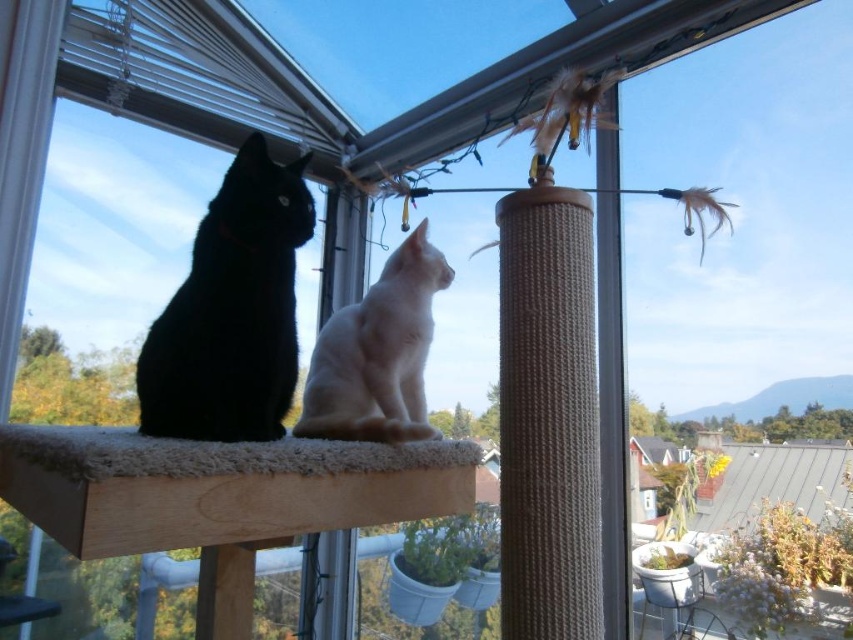
Which is more to the right, braided rope scratching post at center or black matte cat at left?

Positioned to the right is braided rope scratching post at center.

Does point (572, 486) come farther from viewer compared to point (283, 362)?

No.

Describe the element at coordinates (548, 417) in the screenshot. The height and width of the screenshot is (640, 853). I see `braided rope scratching post at center` at that location.

At what (x,y) coordinates should I click in order to perform the action: click on braided rope scratching post at center. Please return your answer as a coordinate pair (x, y). The image size is (853, 640). Looking at the image, I should click on (548, 417).

Which is behind, point (289, 189) or point (314, 435)?

Point (314, 435)

Between black matte cat at left and white fur cat at center, which one has more height?

black matte cat at left is taller.

Is point (229, 428) more distant than point (383, 424)?

No.

This screenshot has width=853, height=640. I want to click on black matte cat at left, so click(x=231, y=310).

Who is more distant from viewer, (521, 248) or (393, 380)?

The point (393, 380) is behind.

Does braided rope scratching post at center appear on the left side of white fur cat at center?

In fact, braided rope scratching post at center is to the right of white fur cat at center.

Who is more forward, (553,326) or (329,328)?

Point (553,326) is in front.

Locate an element on the screen. braided rope scratching post at center is located at coordinates (548, 417).